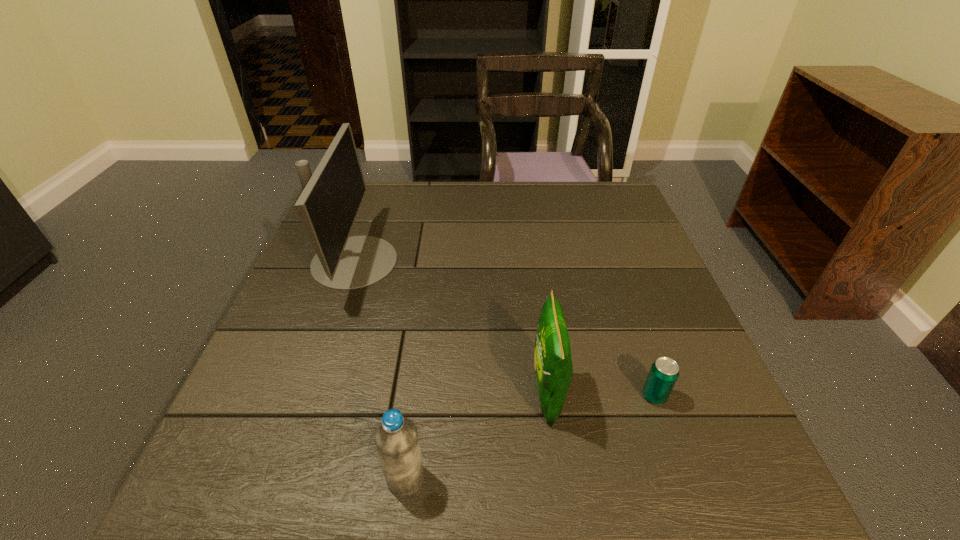
Find the location of a particular element. This screenshot has height=540, width=960. vacant region that satisfies the following two spatial constraints: 1. on the front-facing side of the third object from left to right; 2. on the back side of the shortest object is located at coordinates (547, 396).

Locate an element on the screen. Image resolution: width=960 pixels, height=540 pixels. vacant area in the image that satisfies the following two spatial constraints: 1. on the back side of the shortest object; 2. on the left side of the nearest object is located at coordinates point(417,396).

I want to click on free region that satisfies the following two spatial constraints: 1. on the front-facing side of the rightmost object; 2. on the right side of the crisp (potato chip), so click(x=547, y=396).

You are a GUI agent. You are given a task and a screenshot of the screen. Output one action in this format:
    pyautogui.click(x=<x>, y=<y>)
    Task: Click on the free location that satisfies the following two spatial constraints: 1. on the screen of the leftmost object; 2. on the back side of the shortest object
    The image size is (960, 540).
    Given the screenshot: What is the action you would take?
    pyautogui.click(x=308, y=396)

The width and height of the screenshot is (960, 540). In order to click on blank space that satisfies the following two spatial constraints: 1. on the screen of the farthest object; 2. on the left side of the beer can in this screenshot , I will do `click(308, 396)`.

Where is `vacant space that satisfies the following two spatial constraints: 1. on the front-facing side of the crisp (potato chip); 2. on the right side of the rightmost object`? vacant space that satisfies the following two spatial constraints: 1. on the front-facing side of the crisp (potato chip); 2. on the right side of the rightmost object is located at coordinates (547, 396).

This screenshot has height=540, width=960. Find the location of `free location that satisfies the following two spatial constraints: 1. on the back side of the rightmost object; 2. on the screen of the tallest object`. free location that satisfies the following two spatial constraints: 1. on the back side of the rightmost object; 2. on the screen of the tallest object is located at coordinates (608, 261).

Identify the location of free location that satisfies the following two spatial constraints: 1. on the screen of the tallest object; 2. on the back side of the third object from right to left. (280, 478).